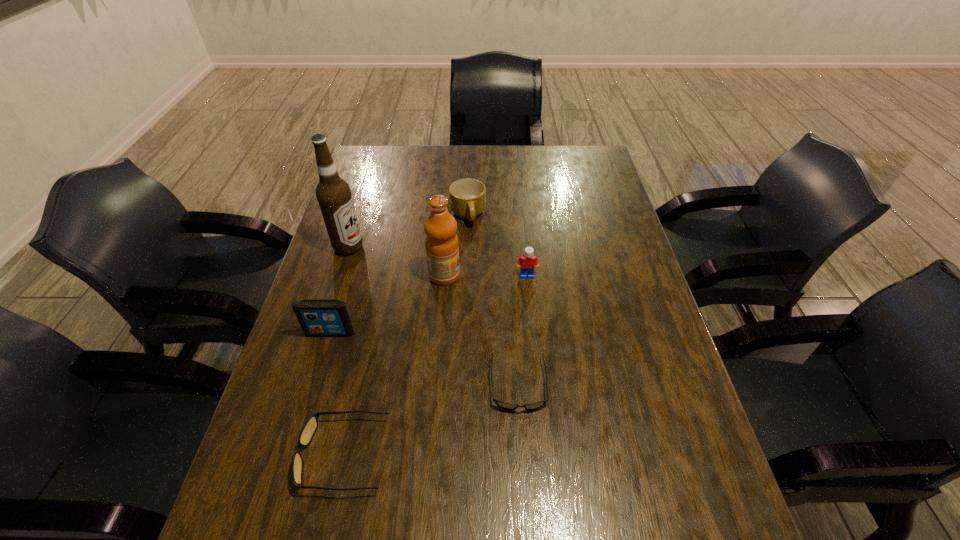
Locate an element on the screen. This screenshot has width=960, height=540. vacant space that satisfies the following two spatial constraints: 1. on the label side of the sixth shortest object; 2. on the front screen of the third nearest object is located at coordinates (440, 333).

What are the coordinates of `free region that satisfies the following two spatial constraints: 1. on the side with the handle of the fifth tallest object; 2. on the front-facing side of the left sunglasses` in the screenshot? It's located at (461, 455).

Identify the location of free location that satisfies the following two spatial constraints: 1. on the side with the handle of the mug; 2. on the label of the tallest object. The image size is (960, 540). (467, 247).

The image size is (960, 540). Identify the location of free space in the image that satisfies the following two spatial constraints: 1. on the label side of the fruit juice; 2. on the front screen of the third nearest object. (440, 333).

Locate an element on the screen. The image size is (960, 540). vacant space that satisfies the following two spatial constraints: 1. on the side with the handle of the third shortest object; 2. on the label of the tallest object is located at coordinates (467, 247).

This screenshot has width=960, height=540. What are the coordinates of `vacant area in the image that satisfies the following two spatial constraints: 1. on the face of the Lego; 2. on the front-facing side of the left sunglasses` in the screenshot? It's located at (545, 455).